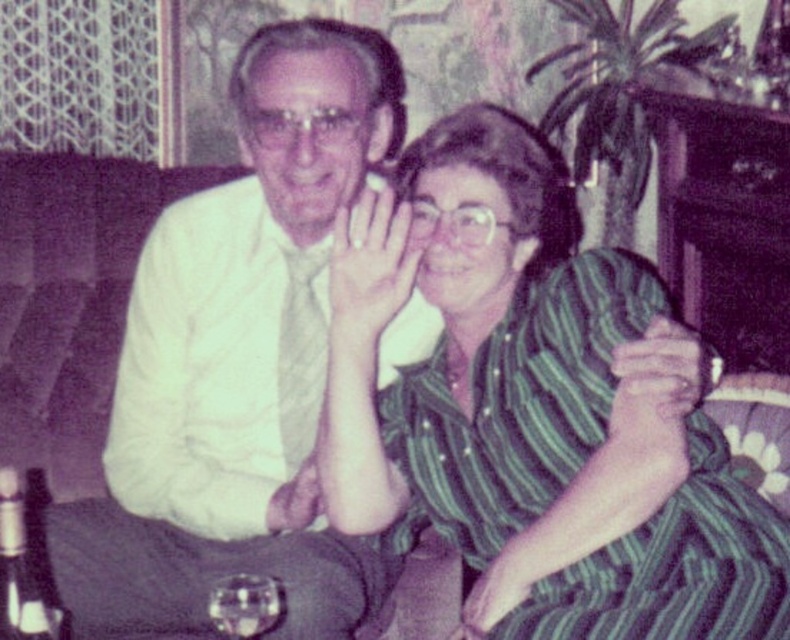
Is green striped dress at center to the right of white matte shirt at center from the viewer's perspective?

Indeed, green striped dress at center is positioned on the right side of white matte shirt at center.

Is green striped dress at center to the left of white matte shirt at center from the viewer's perspective?

In fact, green striped dress at center is to the right of white matte shirt at center.

Who is more distant from viewer, (757, 621) or (152, 532)?

The point (152, 532) is behind.

The image size is (790, 640). I want to click on green striped dress at center, so click(x=535, y=410).

Which of these two, white matte shirt at center or clear glass bottle at lower left, stands taller?

white matte shirt at center is taller.

Between point (237, 342) and point (32, 611), which one is positioned in front?

Point (32, 611)

Between point (167, 548) and point (0, 625), which one is positioned behind?

The point (167, 548) is more distant.

Find the location of `white matte shirt at center`. white matte shirt at center is located at coordinates (239, 362).

Is clear glass bottle at lower left below transparent glass at lower center?

Actually, clear glass bottle at lower left is above transparent glass at lower center.

Does clear glass bottle at lower left have a larger size compared to transparent glass at lower center?

Indeed, clear glass bottle at lower left has a larger size compared to transparent glass at lower center.

Who is more forward, (13, 522) or (246, 600)?

Point (13, 522) is in front.

This screenshot has height=640, width=790. Identify the location of clear glass bottle at lower left. (21, 572).